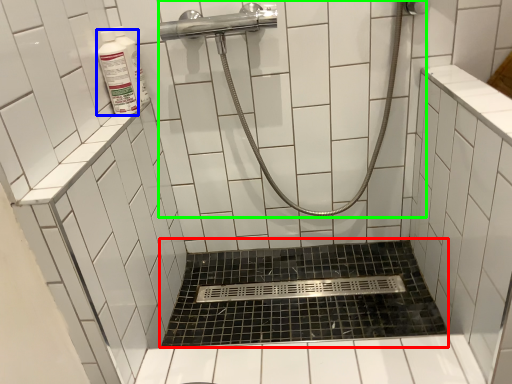
Question: Which object is the closest to the bath (highlighted by a red box)? Choose among these: cleaning product (highlighted by a blue box) or shower (highlighted by a green box).

Choices:
 (A) cleaning product
 (B) shower

Answer: (B)